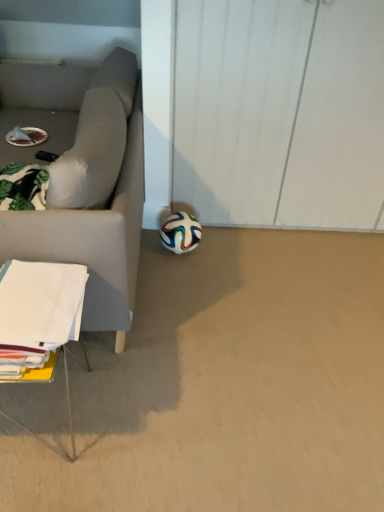
Looking at this image, measure the distance between point (27, 282) and camera.

Point (27, 282) is 3.89 feet from camera.

What do you see at coordinates (42, 314) in the screenshot? I see `white paper at lower left` at bounding box center [42, 314].

Image resolution: width=384 pixels, height=512 pixels. What are the coordinates of `white paper at lower left` in the screenshot? It's located at (42, 314).

What do you see at coordinates (181, 233) in the screenshot?
I see `multicolored rubber football at lower center` at bounding box center [181, 233].

Image resolution: width=384 pixels, height=512 pixels. I want to click on multicolored rubber football at lower center, so click(x=181, y=233).

Locate an element on the screen. The height and width of the screenshot is (512, 384). white paper at lower left is located at coordinates (42, 314).

Visually, is white paper at lower left positioned to the left or to the right of multicolored rubber football at lower center?

Clearly, white paper at lower left is on the left of multicolored rubber football at lower center in the image.

Between white paper at lower left and multicolored rubber football at lower center, which one is positioned in front?

white paper at lower left is more forward.

Does point (68, 339) lie in front of point (176, 216)?

Yes, point (68, 339) is in front of point (176, 216).

Consider the image. From the image's perspective, which one is positioned lower, white paper at lower left or multicolored rubber football at lower center?

From the image's view, white paper at lower left is below.

From a real-world perspective, which is physically above, white paper at lower left or multicolored rubber football at lower center?

white paper at lower left is physically above.

Is white paper at lower left wider or thinner than multicolored rubber football at lower center?

Clearly, white paper at lower left has more width compared to multicolored rubber football at lower center.

From their relative heights in the image, would you say white paper at lower left is taller or shorter than multicolored rubber football at lower center?

In the image, white paper at lower left appears to be taller than multicolored rubber football at lower center.

Does white paper at lower left have a larger size compared to multicolored rubber football at lower center?

Yes.

Can multicolored rubber football at lower center be found inside white paper at lower left?

No.

From the picture: Are white paper at lower left and multicolored rubber football at lower center located far from each other?

No, white paper at lower left is not far away from multicolored rubber football at lower center.

Does white paper at lower left turn towards multicolored rubber football at lower center?

No, white paper at lower left is not aimed at multicolored rubber football at lower center.

What's the angular difference between white paper at lower left and multicolored rubber football at lower center's facing directions?

The angular difference between white paper at lower left and multicolored rubber football at lower center is 0.000709 degrees.

Based on the photo, how far apart are white paper at lower left and multicolored rubber football at lower center?

white paper at lower left and multicolored rubber football at lower center are 35.53 inches apart.

Locate an element on the screen. Image resolution: width=384 pixels, height=512 pixels. football located underneath the white paper at lower left (from a real-world perspective) is located at coordinates (181, 233).

Looking at this image, can you confirm if multicolored rubber football at lower center is positioned to the right of white paper at lower left?

Correct, you'll find multicolored rubber football at lower center to the right of white paper at lower left.

Which is behind, multicolored rubber football at lower center or white paper at lower left?

multicolored rubber football at lower center is further away from the camera.

Is point (180, 239) positioned behind point (62, 305)?

Yes, point (180, 239) is behind point (62, 305).

From the image's perspective, between multicolored rubber football at lower center and white paper at lower left, who is located below?

white paper at lower left.

From a real-world perspective, which is physically below, multicolored rubber football at lower center or white paper at lower left?

multicolored rubber football at lower center, from a real-world perspective.

In terms of width, does multicolored rubber football at lower center look wider or thinner when compared to white paper at lower left?

multicolored rubber football at lower center is thinner than white paper at lower left.

Who is shorter, multicolored rubber football at lower center or white paper at lower left?

With less height is multicolored rubber football at lower center.

Considering the sizes of multicolored rubber football at lower center and white paper at lower left in the image, is multicolored rubber football at lower center bigger or smaller than white paper at lower left?

multicolored rubber football at lower center is smaller than white paper at lower left.

Looking at this image, is white paper at lower left completely or partially inside multicolored rubber football at lower center?

No, white paper at lower left is not a part of multicolored rubber football at lower center.

Are multicolored rubber football at lower center and white paper at lower left making contact?

They are not placed beside each other.

Could you tell me if multicolored rubber football at lower center is turned towards white paper at lower left?

No, multicolored rubber football at lower center is not facing towards white paper at lower left.

Can you tell me how much multicolored rubber football at lower center and white paper at lower left differ in facing direction?

There is a 0.000709-degree angle between the facing directions of multicolored rubber football at lower center and white paper at lower left.

In the image, there is a white paper at lower left. At what (x,y) coordinates should I click in order to perform the action: click on football above it (from the image's perspective). Please return your answer as a coordinate pair (x, y). Looking at the image, I should click on (181, 233).

Identify the location of football on the right of white paper at lower left. The height and width of the screenshot is (512, 384). (181, 233).

I want to click on table in front of the multicolored rubber football at lower center, so click(42, 314).